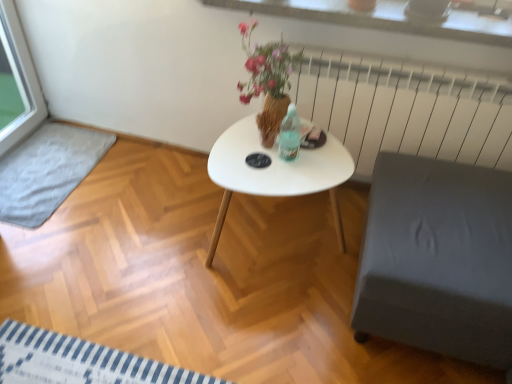
Question: Is white metal radiator at upper right at the left side of white glossy table at center?

Choices:
 (A) yes
 (B) no

Answer: (B)

Question: Does white metal radiator at upper right come behind white glossy table at center?

Choices:
 (A) yes
 (B) no

Answer: (A)

Question: From the image's perspective, is white metal radiator at upper right on top of white glossy table at center?

Choices:
 (A) no
 (B) yes

Answer: (B)

Question: Considering the relative sizes of white metal radiator at upper right and white glossy table at center in the image provided, is white metal radiator at upper right shorter than white glossy table at center?

Choices:
 (A) yes
 (B) no

Answer: (B)

Question: From a real-world perspective, is white metal radiator at upper right positioned over white glossy table at center based on gravity?

Choices:
 (A) no
 (B) yes

Answer: (B)

Question: Do you think white metal radiator at upper right is within white textured stone at upper center, or outside of it?

Choices:
 (A) inside
 (B) outside

Answer: (B)

Question: From a real-world perspective, is white metal radiator at upper right above or below white textured stone at upper center?

Choices:
 (A) above
 (B) below

Answer: (B)

Question: In terms of size, does white metal radiator at upper right appear bigger or smaller than white textured stone at upper center?

Choices:
 (A) small
 (B) big

Answer: (B)

Question: In terms of width, does white metal radiator at upper right look wider or thinner when compared to white textured stone at upper center?

Choices:
 (A) thin
 (B) wide

Answer: (A)

Question: In terms of height, does white glossy table at center look taller or shorter compared to white matte coffee table at center?

Choices:
 (A) tall
 (B) short

Answer: (B)

Question: From a real-world perspective, is white glossy table at center positioned above or below white matte coffee table at center?

Choices:
 (A) above
 (B) below

Answer: (B)

Question: Does point (267, 225) appear closer or farther from the camera than point (261, 180)?

Choices:
 (A) farther
 (B) closer

Answer: (A)

Question: Would you say white glossy table at center is inside or outside white matte coffee table at center?

Choices:
 (A) outside
 (B) inside

Answer: (A)

Question: From their relative heights in the image, would you say gray fabric mat at lower left is taller or shorter than white matte coffee table at center?

Choices:
 (A) tall
 (B) short

Answer: (B)

Question: Is gray fabric mat at lower left bigger or smaller than white matte coffee table at center?

Choices:
 (A) small
 (B) big

Answer: (A)